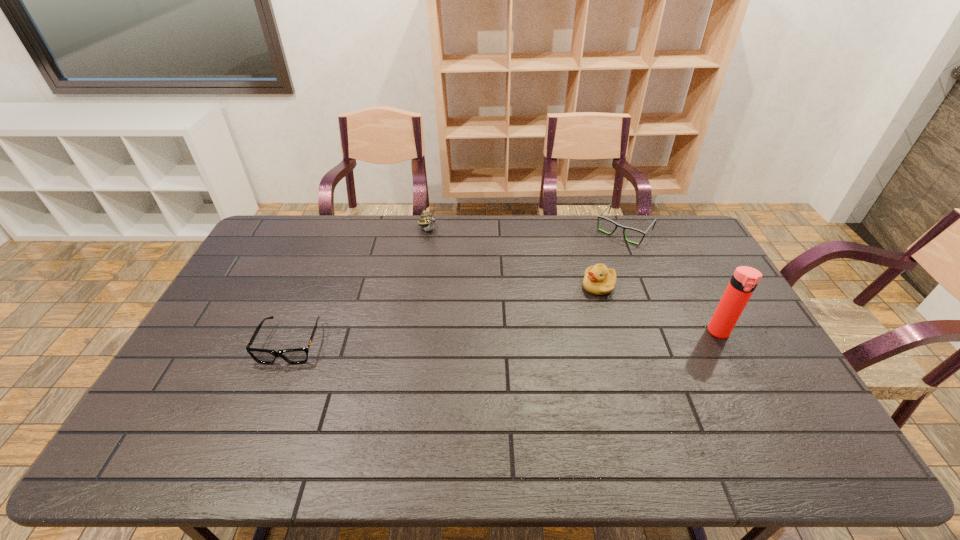
This screenshot has height=540, width=960. What are the coordinates of `free spot between the spectacles and the snail` in the screenshot? It's located at (526, 231).

Identify the location of unoccupied position between the tallest object and the sunglasses. (505, 338).

At what (x,y) coordinates should I click in order to perform the action: click on vacant point located between the third tallest object and the leftmost object. Please return your answer as a coordinate pair (x, y). Looking at the image, I should click on pyautogui.click(x=444, y=315).

Locate an element on the screen. Image resolution: width=960 pixels, height=540 pixels. vacant space that is in between the leftmost object and the duckling is located at coordinates (444, 315).

Identify the location of unoccupied area between the spectacles and the thermos bottle. This screenshot has width=960, height=540. (671, 281).

You are a GUI agent. You are given a task and a screenshot of the screen. Output one action in this format:
    pyautogui.click(x=<x>, y=<y>)
    Task: Click on the free spot between the second object from left to right and the duckling
    The image size is (960, 540).
    Given the screenshot: What is the action you would take?
    pyautogui.click(x=514, y=259)

In order to click on unoccupied position between the fourth shortest object and the leftmost object in this screenshot , I will do `click(359, 287)`.

The image size is (960, 540). Identify the location of vacant point located between the second tallest object and the sunglasses. (359, 287).

Find the location of a particular element. empty space between the second object from left to right and the leftmost object is located at coordinates pyautogui.click(x=359, y=287).

Where is `free spot between the third nearest object and the second tallest object`? free spot between the third nearest object and the second tallest object is located at coordinates (514, 259).